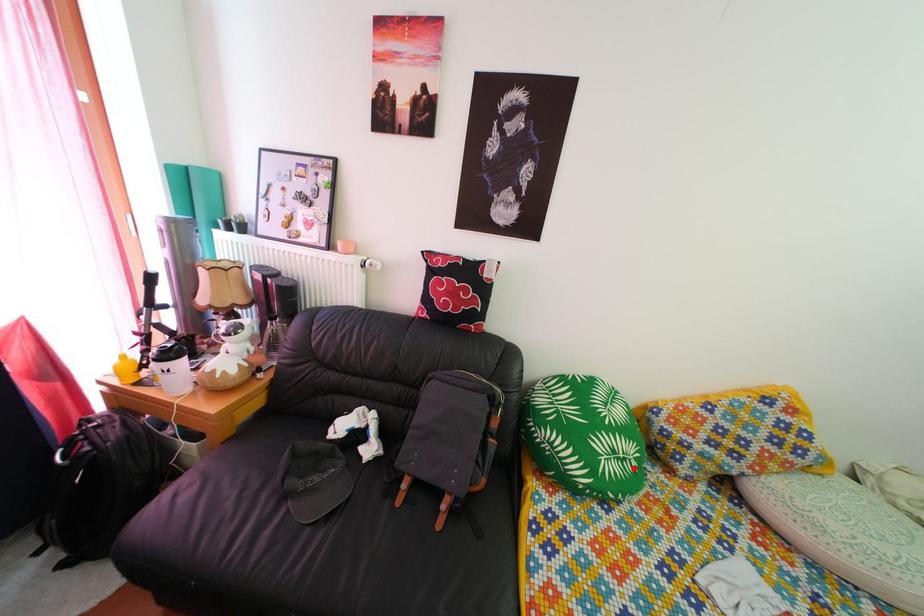
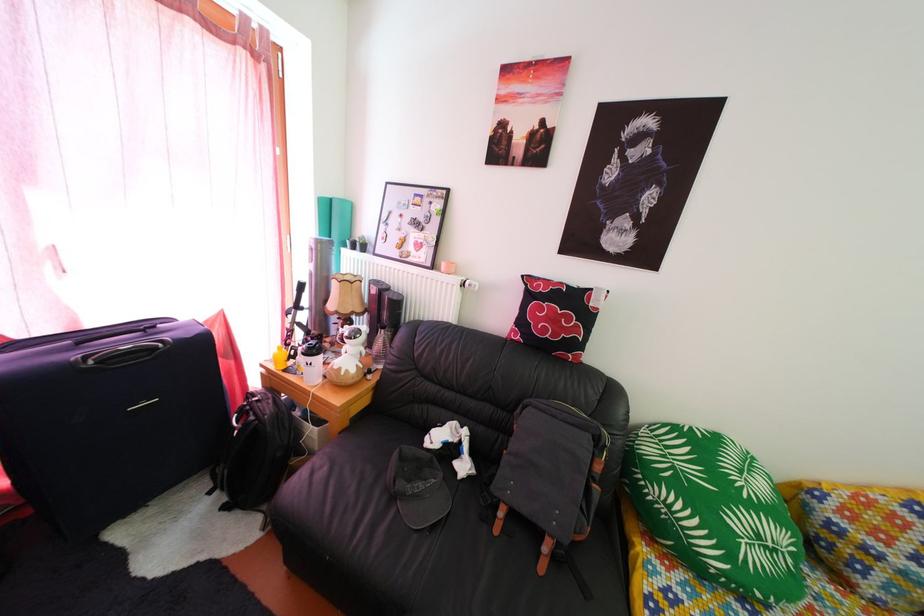
Locate, in the second image, the point that corresponds to the highlighted location in the first image.

(784, 560)